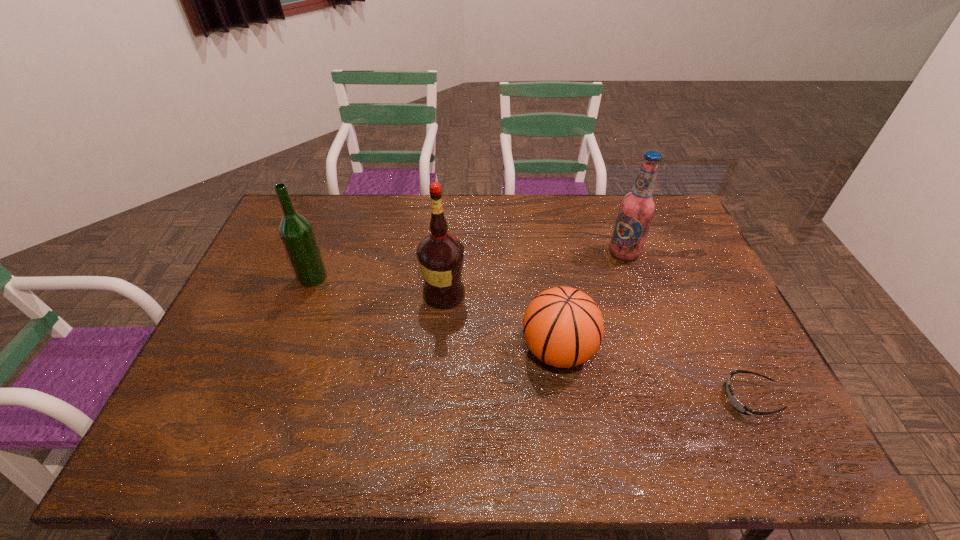
What are the coordinates of `the second closest alcohol to the leftmost object` in the screenshot? It's located at (637, 207).

Locate which alcohol ranks second in proximity to the basketball. Please provide its 2D coordinates. Your answer should be formatted as a tuple, i.e. [(x, y)], where the tuple contains the x and y coordinates of a point satisfying the conditions above.

[(637, 207)]

Locate an element on the screen. The image size is (960, 540). vacant area that satisfies the following two spatial constraints: 1. on the front side of the third object from left to right; 2. on the right side of the leftmost alcohol is located at coordinates (285, 350).

Identify the location of vacant space that satisfies the following two spatial constraints: 1. on the label of the second alcohol from right to left; 2. on the right side of the third object from right to left. This screenshot has height=540, width=960. (440, 350).

This screenshot has height=540, width=960. I want to click on free space that satisfies the following two spatial constraints: 1. on the back side of the farthest object; 2. on the left side of the second shortest object, so click(543, 253).

This screenshot has height=540, width=960. Find the location of `free space that satisfies the following two spatial constraints: 1. on the back side of the third object from left to right; 2. on the right side of the second object from right to left`. free space that satisfies the following two spatial constraints: 1. on the back side of the third object from left to right; 2. on the right side of the second object from right to left is located at coordinates coord(543,253).